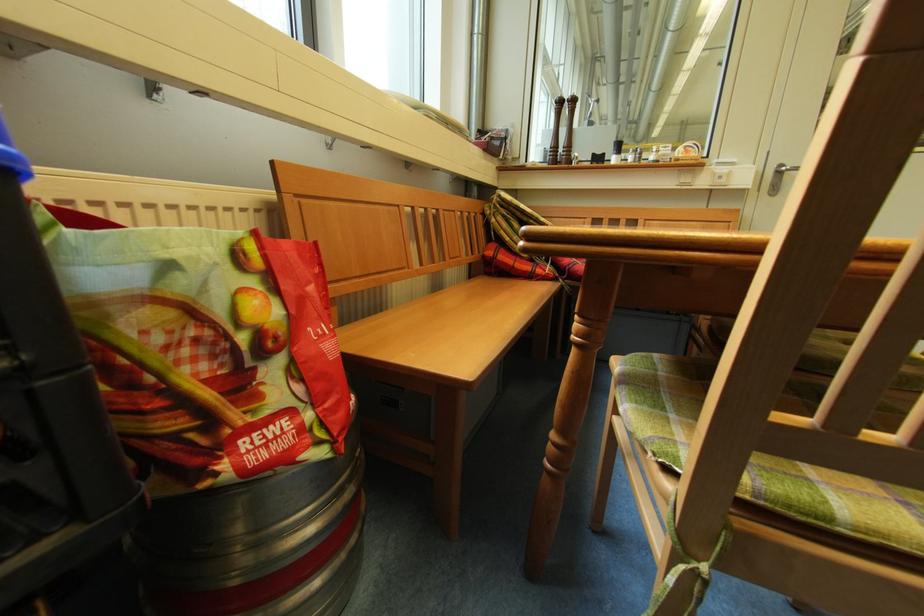
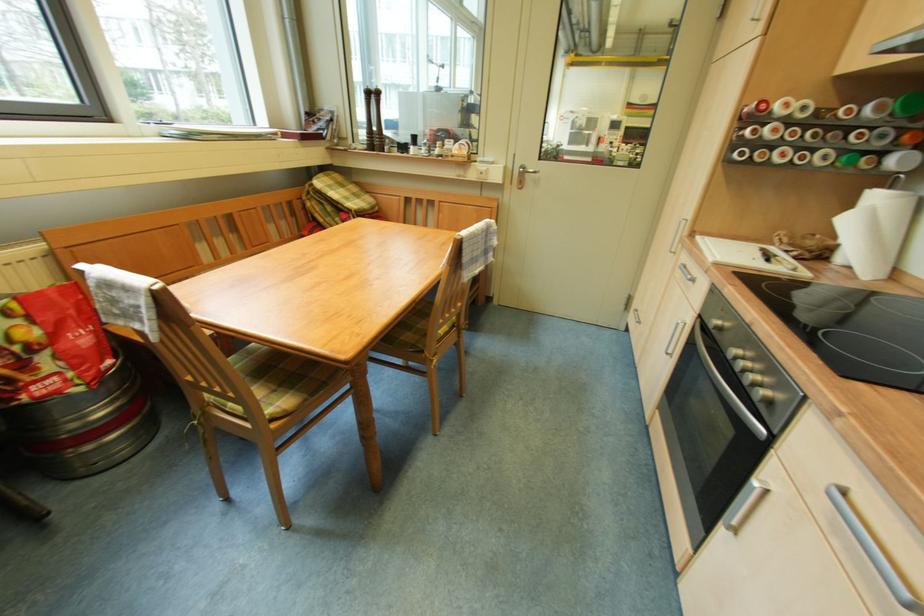
In a continuous first-person perspective shot, in which direction is the camera moving?

The movement direction of the cameraman is right, backward.